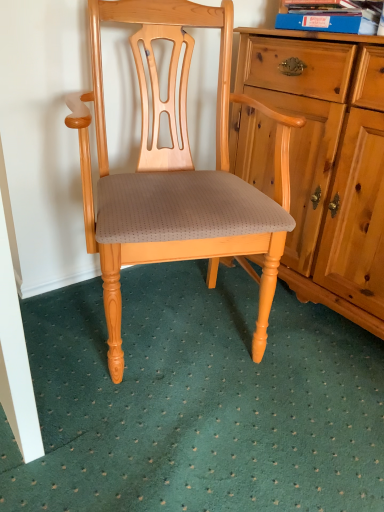
Question: Considering the relative sizes of green textured carpet at lower center and matte wood chair at center in the image provided, is green textured carpet at lower center thinner than matte wood chair at center?

Choices:
 (A) no
 (B) yes

Answer: (A)

Question: Would you say green textured carpet at lower center is outside matte wood chair at center?

Choices:
 (A) yes
 (B) no

Answer: (A)

Question: Would you say green textured carpet at lower center is a long distance from matte wood chair at center?

Choices:
 (A) no
 (B) yes

Answer: (A)

Question: Is green textured carpet at lower center oriented away from matte wood chair at center?

Choices:
 (A) yes
 (B) no

Answer: (B)

Question: From the image's perspective, would you say green textured carpet at lower center is shown under matte wood chair at center?

Choices:
 (A) no
 (B) yes

Answer: (B)

Question: Is green textured carpet at lower center taller than matte wood chair at center?

Choices:
 (A) yes
 (B) no

Answer: (B)

Question: Considering the relative sizes of green textured carpet at lower center and blue cardboard book at upper right in the image provided, is green textured carpet at lower center taller than blue cardboard book at upper right?

Choices:
 (A) no
 (B) yes

Answer: (A)

Question: Is green textured carpet at lower center surrounding blue cardboard book at upper right?

Choices:
 (A) yes
 (B) no

Answer: (B)

Question: Considering the relative sizes of green textured carpet at lower center and blue cardboard book at upper right in the image provided, is green textured carpet at lower center smaller than blue cardboard book at upper right?

Choices:
 (A) no
 (B) yes

Answer: (A)

Question: From the image's perspective, is green textured carpet at lower center beneath blue cardboard book at upper right?

Choices:
 (A) no
 (B) yes

Answer: (B)

Question: From a real-world perspective, is green textured carpet at lower center on blue cardboard book at upper right?

Choices:
 (A) yes
 (B) no

Answer: (B)

Question: Is green textured carpet at lower center next to blue cardboard book at upper right and touching it?

Choices:
 (A) no
 (B) yes

Answer: (A)

Question: Is blue cardboard book at upper right oriented towards green textured carpet at lower center?

Choices:
 (A) yes
 (B) no

Answer: (B)